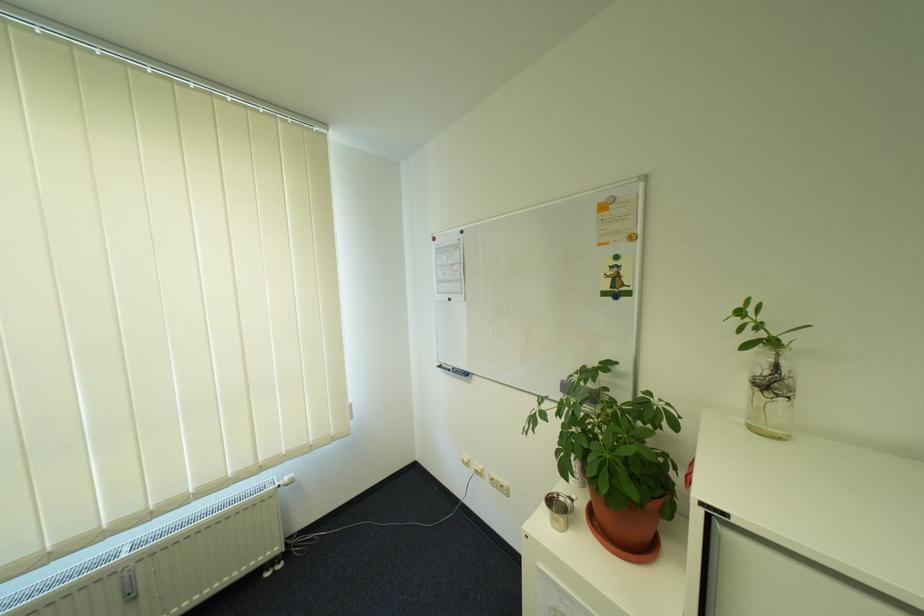
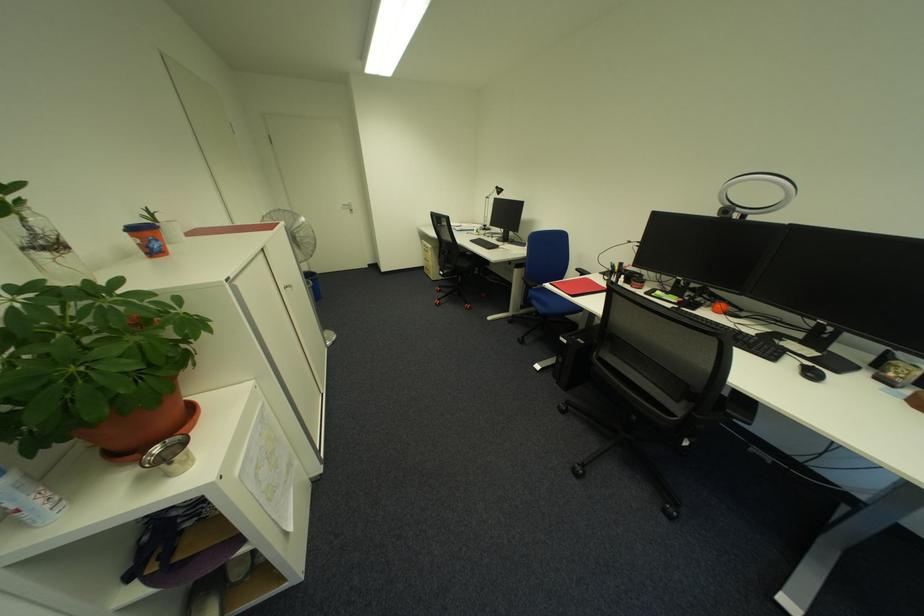
In the second image, find the point that corresponds to (785,369) in the first image.

(40, 230)